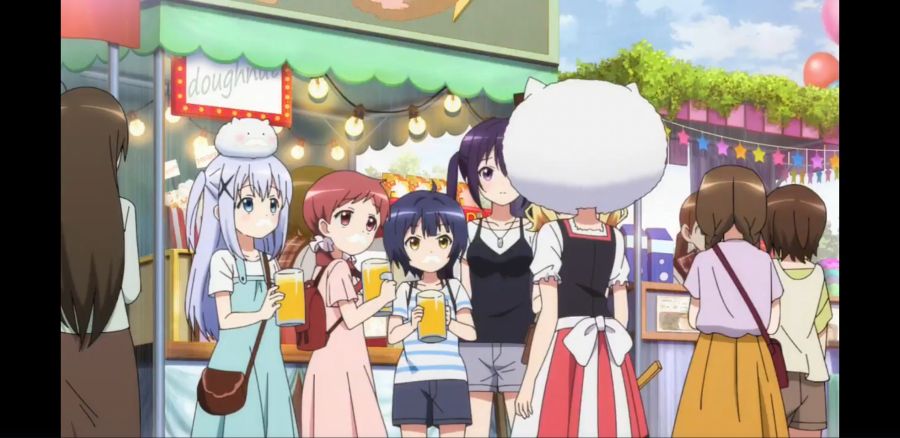
Find the location of a particular element. The image size is (900, 438). strings of lights is located at coordinates (384, 113), (291, 134), (145, 109).